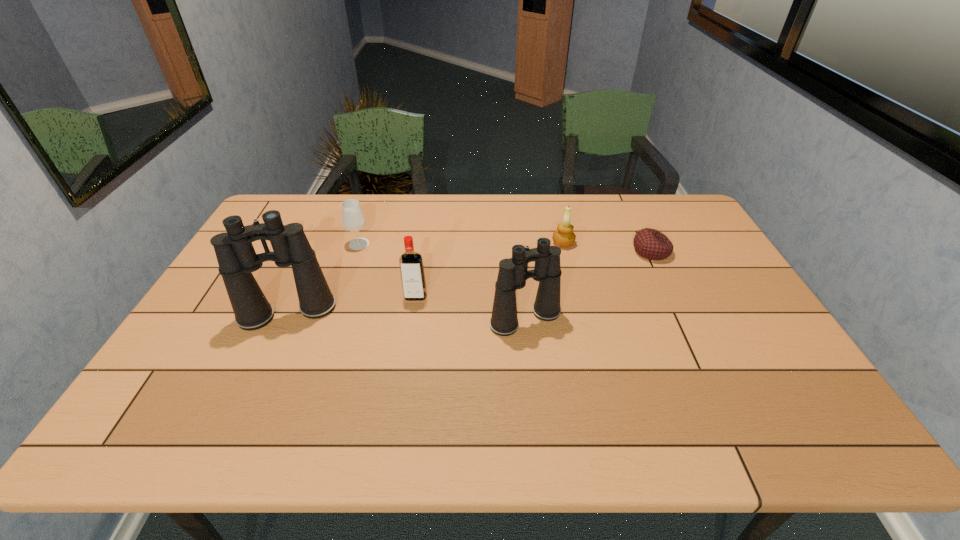
At what (x,y) coordinates should I click in order to perform the action: click on free space located on the left of the left binoculars. Please return your answer as a coordinate pair (x, y). The image size is (960, 540). Looking at the image, I should click on (203, 313).

Where is `free point located 0.110m on the right of the second tallest object`? The image size is (960, 540). free point located 0.110m on the right of the second tallest object is located at coordinates (602, 319).

Where is `free space located on the left of the candle_holder`? free space located on the left of the candle_holder is located at coordinates (533, 243).

Locate an element on the screen. The image size is (960, 540). free location located on the front of the rightmost object is located at coordinates pos(671,294).

Where is `vacant space located on the front of the glass`? The image size is (960, 540). vacant space located on the front of the glass is located at coordinates (326, 339).

Where is `free location located on the front and back of the vodka`? The width and height of the screenshot is (960, 540). free location located on the front and back of the vodka is located at coordinates (409, 339).

Image resolution: width=960 pixels, height=540 pixels. In order to click on object at the left edge in this screenshot , I will do `click(237, 259)`.

You are a GUI agent. You are given a task and a screenshot of the screen. Output one action in this format:
    pyautogui.click(x=<x>, y=<y>)
    Task: Click on the object positioned at the right edge
    
    Given the screenshot: What is the action you would take?
    pyautogui.click(x=651, y=244)

The height and width of the screenshot is (540, 960). Identify the location of free space at the far edge. (540, 217).

Locate an element on the screen. The width and height of the screenshot is (960, 540). vacant space at the near edge is located at coordinates (x=707, y=399).